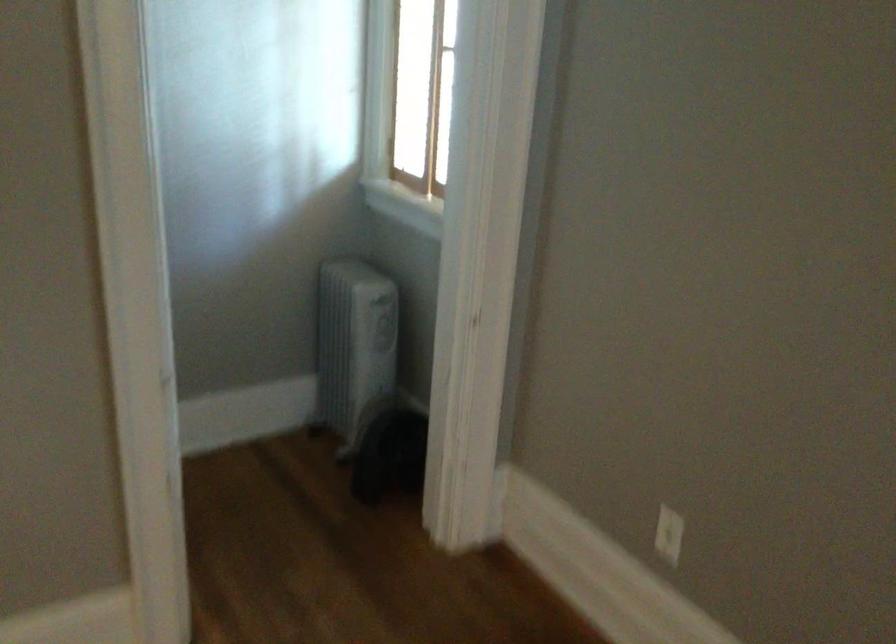
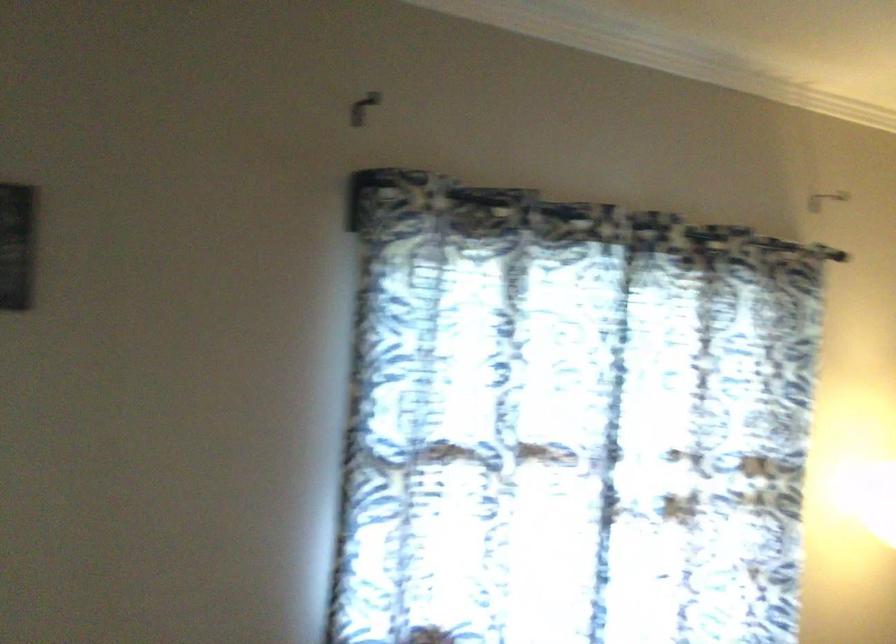
Question: The images are taken continuously from a first-person perspective. In which direction is your viewpoint rotating?

Choices:
 (A) Left
 (B) Right
 (C) Up
 (D) Down

Answer: (B)